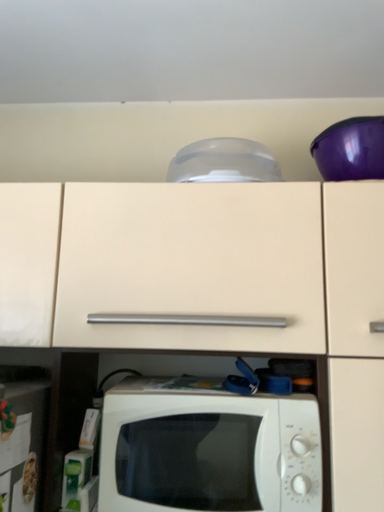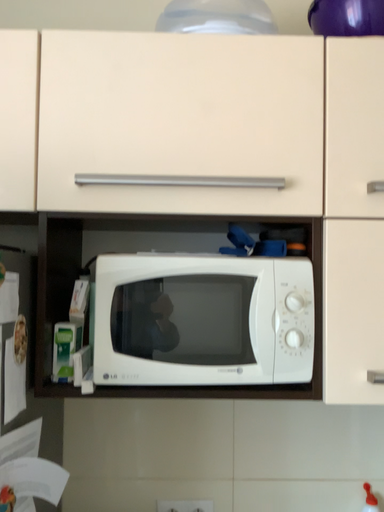
Question: How did the camera likely rotate when shooting the video?

Choices:
 (A) rotated upward
 (B) rotated downward

Answer: (B)